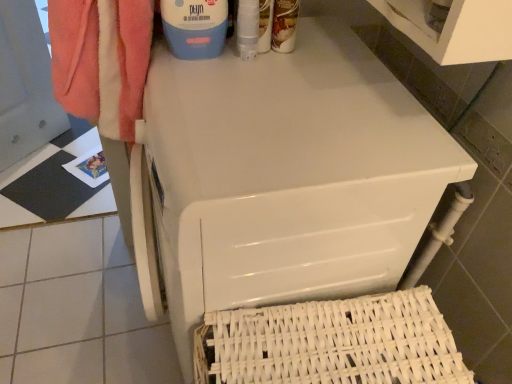
Question: From a real-world perspective, does white woven basket at lower right stand above blue plastic container at upper center, which is counted as the 1th cleaning product, starting from the left?

Choices:
 (A) no
 (B) yes

Answer: (A)

Question: Is white woven basket at lower right shorter than blue plastic container at upper center, which is counted as the 1th cleaning product, starting from the left?

Choices:
 (A) yes
 (B) no

Answer: (B)

Question: Would you say blue plastic container at upper center, acting as the 2th cleaning product starting from the right, is part of white woven basket at lower right's contents?

Choices:
 (A) yes
 (B) no

Answer: (B)

Question: Does white woven basket at lower right turn towards blue plastic container at upper center, acting as the 2th cleaning product starting from the right?

Choices:
 (A) yes
 (B) no

Answer: (B)

Question: Is white woven basket at lower right not within blue plastic container at upper center, which is counted as the 1th cleaning product, starting from the left?

Choices:
 (A) no
 (B) yes

Answer: (B)

Question: Is white woven basket at lower right next to blue plastic container at upper center, acting as the 2th cleaning product starting from the right, and touching it?

Choices:
 (A) no
 (B) yes

Answer: (A)

Question: Can you confirm if white woven basket at lower right is smaller than white glossy washing machine at upper center?

Choices:
 (A) no
 (B) yes

Answer: (B)

Question: Is the depth of white woven basket at lower right greater than that of white glossy washing machine at upper center?

Choices:
 (A) yes
 (B) no

Answer: (A)

Question: Does white woven basket at lower right have a greater width compared to white glossy washing machine at upper center?

Choices:
 (A) no
 (B) yes

Answer: (A)

Question: Is white woven basket at lower right touching white glossy washing machine at upper center?

Choices:
 (A) yes
 (B) no

Answer: (B)

Question: From a real-world perspective, is white woven basket at lower right on top of white glossy washing machine at upper center?

Choices:
 (A) no
 (B) yes

Answer: (A)

Question: From the image's perspective, would you say white woven basket at lower right is positioned over white glossy washing machine at upper center?

Choices:
 (A) yes
 (B) no

Answer: (B)

Question: From the image's perspective, is matte brown bottle at upper center, the 1th cleaning product positioned from the right, located beneath white glossy washing machine at upper center?

Choices:
 (A) no
 (B) yes

Answer: (A)